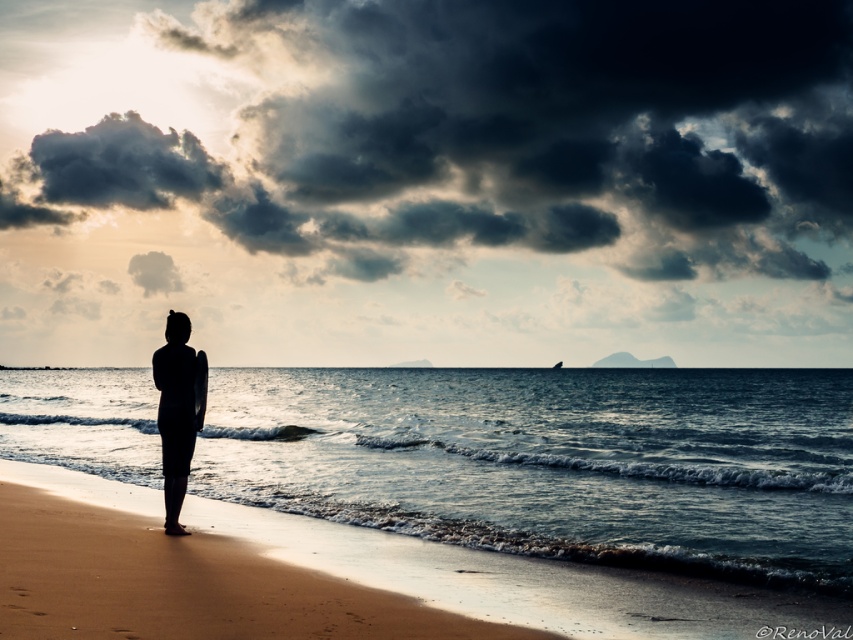
Question: Observing the image, what is the correct spatial positioning of sandy beach at lower left in reference to silhouette surfboard at center?

Choices:
 (A) left
 (B) right

Answer: (B)

Question: Does sandy beach at lower left have a smaller size compared to silhouette surfboard at center?

Choices:
 (A) no
 (B) yes

Answer: (B)

Question: Can you confirm if sandy beach at lower left is smaller than silhouette surfboard at center?

Choices:
 (A) no
 (B) yes

Answer: (B)

Question: Which point appears farthest from the camera in this image?

Choices:
 (A) (166, 406)
 (B) (80, 513)

Answer: (B)

Question: Which of the following is the farthest from the observer?

Choices:
 (A) (184, 404)
 (B) (132, 620)

Answer: (A)